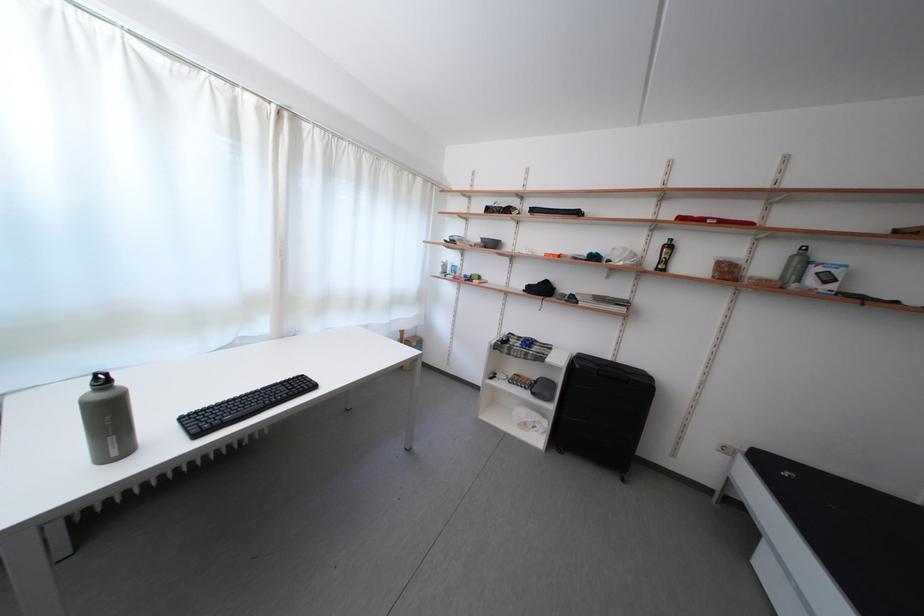
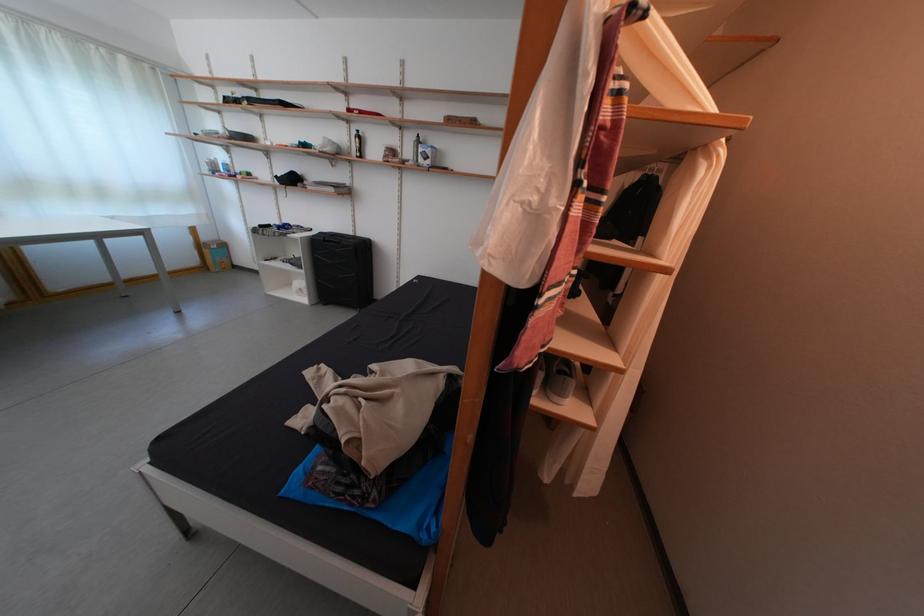
What movement of the cameraman would produce the second image?

The cameraman moved toward right, backward.